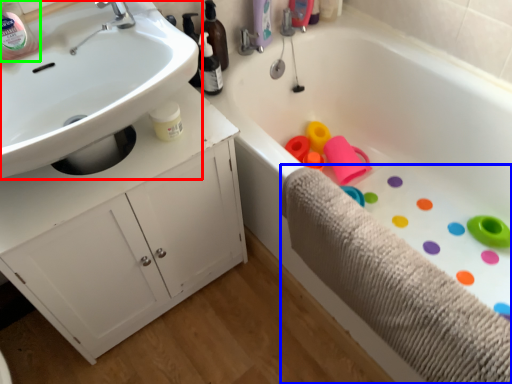
Question: Which object is positioned farthest from sink (highlighted by a red box)? Select from bath towel (highlighted by a blue box) and bottle (highlighted by a green box).

Choices:
 (A) bath towel
 (B) bottle

Answer: (A)